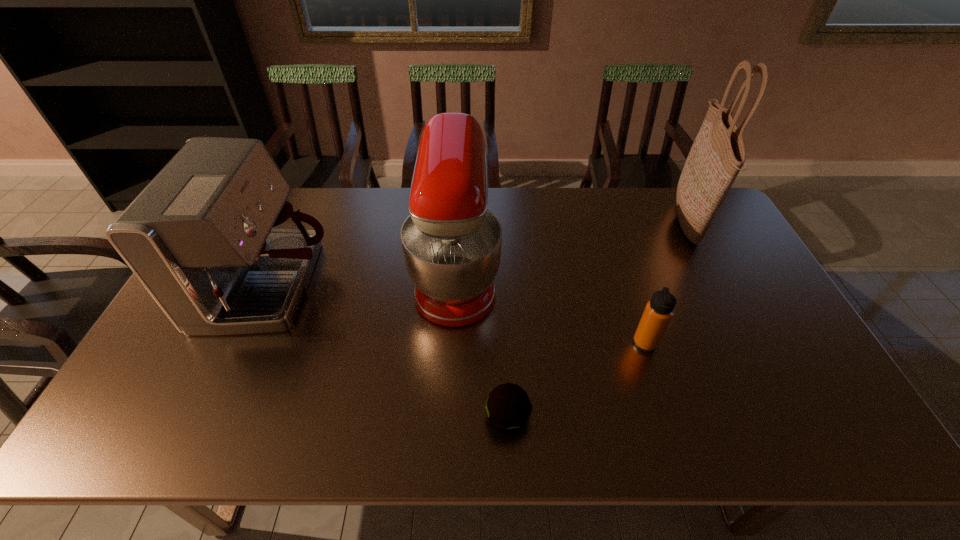
The width and height of the screenshot is (960, 540). I want to click on free space located 0.390m on the front of the coffee maker near the spout, so click(465, 286).

Where is `vacant space located 0.350m on the right of the second object from right to left`? The width and height of the screenshot is (960, 540). vacant space located 0.350m on the right of the second object from right to left is located at coordinates (789, 343).

What are the coordinates of `vacant area located 0.240m on the right of the nearest object` in the screenshot? It's located at (634, 416).

What are the coordinates of `shopping bag that is at the far edge` in the screenshot? It's located at (718, 153).

Where is `mixer that is at the far edge`? The height and width of the screenshot is (540, 960). mixer that is at the far edge is located at coordinates (451, 243).

Find the location of a particular element. This screenshot has width=960, height=540. object located at the near edge is located at coordinates (508, 407).

Locate an element on the screen. This screenshot has width=960, height=540. object that is at the left edge is located at coordinates (212, 238).

Locate an element on the screen. This screenshot has height=540, width=960. object located in the right edge section of the desktop is located at coordinates (718, 153).

Find the location of a particular element. object that is at the far right corner is located at coordinates (718, 153).

I want to click on vacant space at the far edge of the desktop, so click(343, 202).